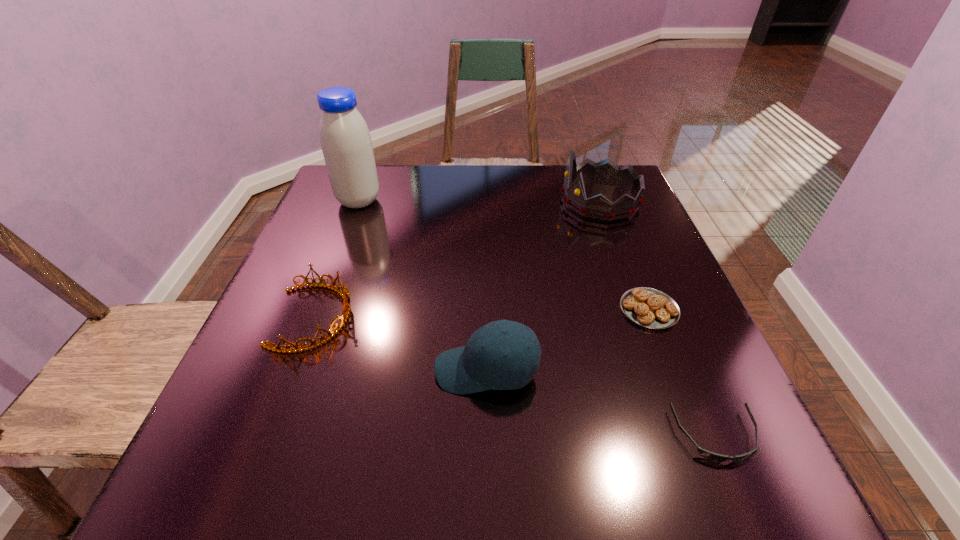
The image size is (960, 540). What are the coordinates of `tiara at the far edge` in the screenshot? It's located at (607, 172).

Locate an element on the screen. This screenshot has height=540, width=960. object at the near edge is located at coordinates (711, 456).

The width and height of the screenshot is (960, 540). Find the location of `soya milk situated at the left edge`. soya milk situated at the left edge is located at coordinates (345, 139).

I want to click on tiara that is positioned at the left edge, so click(344, 293).

Where is `tiara that is at the right edge`? tiara that is at the right edge is located at coordinates (607, 172).

The width and height of the screenshot is (960, 540). Identify the location of pastry that is at the right edge. (648, 307).

Where is `sunglasses at the right edge`? This screenshot has height=540, width=960. sunglasses at the right edge is located at coordinates (711, 456).

This screenshot has width=960, height=540. Identify the location of object present at the far left corner. (345, 139).

What are the coordinates of `object that is at the far right corner` in the screenshot? It's located at (607, 172).

Where is `object located in the near right corner section of the desktop`? This screenshot has width=960, height=540. object located in the near right corner section of the desktop is located at coordinates (711, 456).